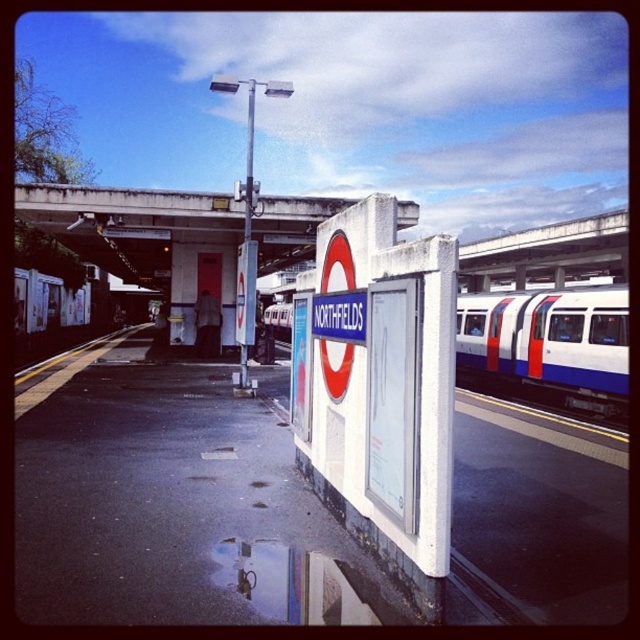
Question: In this image, where is white concrete signboard at center located relative to concrete at upper center?

Choices:
 (A) above
 (B) below

Answer: (B)

Question: Among these objects, which one is nearest to the camera?

Choices:
 (A) concrete at upper center
 (B) white glossy passenger train at right
 (C) white glossy train at center

Answer: (B)

Question: Can you confirm if white concrete signboard at center is positioned below concrete at upper center?

Choices:
 (A) no
 (B) yes

Answer: (B)

Question: Does white glossy train at center have a smaller size compared to white glossy passenger train at right?

Choices:
 (A) yes
 (B) no

Answer: (B)

Question: Which of the following is the closest to the observer?

Choices:
 (A) white glossy train at center
 (B) white glossy passenger train at right
 (C) white concrete signboard at center

Answer: (B)

Question: Which of the following is the closest to the observer?

Choices:
 (A) white glossy passenger train at right
 (B) concrete at upper center

Answer: (A)